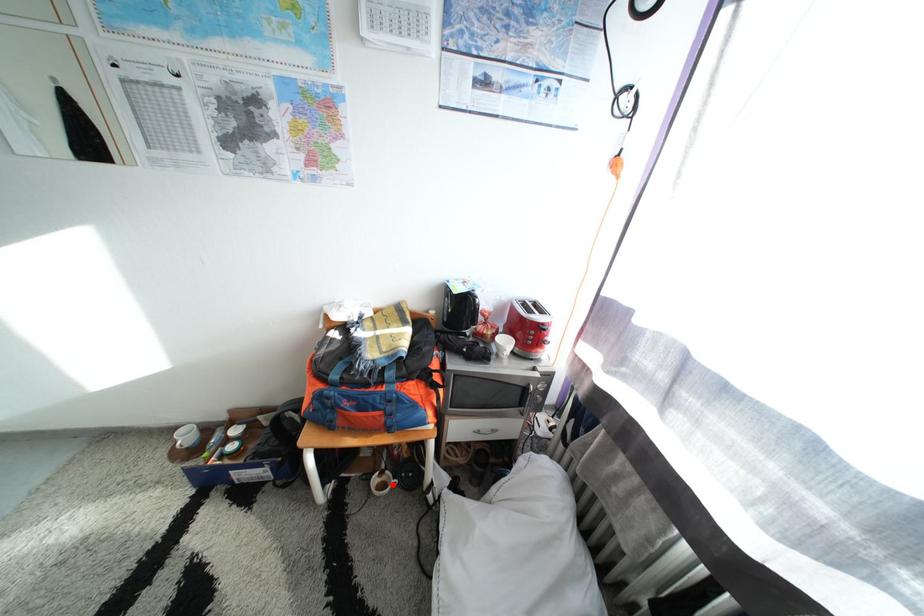
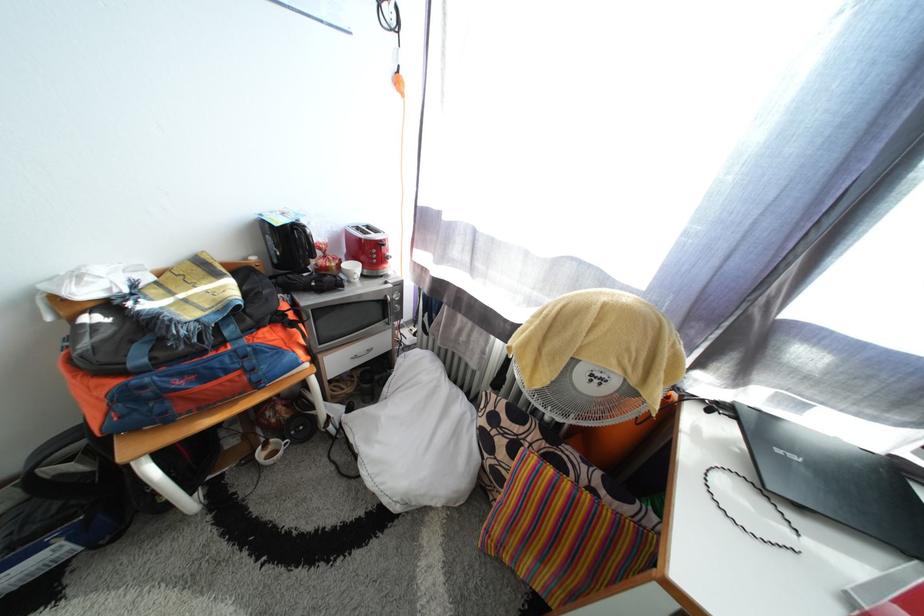
Question: I am providing you with two images of the same scene from different viewpoints. A red point is marked on the first image. Is the red point's position out of view in image 2?

Choices:
 (A) Yes
 (B) No

Answer: (B)